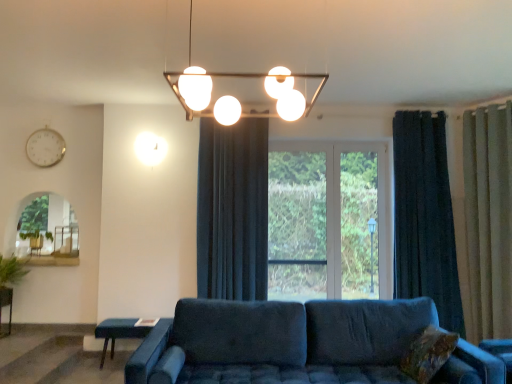
Question: Is velvet blue couch at center positioned far away from metallic pendant light at upper center?

Choices:
 (A) no
 (B) yes

Answer: (B)

Question: Is velvet blue couch at center shorter than metallic pendant light at upper center?

Choices:
 (A) yes
 (B) no

Answer: (B)

Question: Are velvet blue couch at center and metallic pendant light at upper center making contact?

Choices:
 (A) no
 (B) yes

Answer: (A)

Question: Is velvet blue couch at center surrounding metallic pendant light at upper center?

Choices:
 (A) no
 (B) yes

Answer: (A)

Question: Is velvet blue couch at center to the left of metallic pendant light at upper center from the viewer's perspective?

Choices:
 (A) yes
 (B) no

Answer: (B)

Question: Does velvet blue couch at center have a greater width compared to metallic pendant light at upper center?

Choices:
 (A) yes
 (B) no

Answer: (A)

Question: Does velvet blue couch at center lie behind green leafy plant at left?

Choices:
 (A) no
 (B) yes

Answer: (A)

Question: From the image's perspective, would you say velvet blue couch at center is shown under green leafy plant at left?

Choices:
 (A) no
 (B) yes

Answer: (B)

Question: From a real-world perspective, is velvet blue couch at center physically below green leafy plant at left?

Choices:
 (A) no
 (B) yes

Answer: (B)

Question: Is velvet blue couch at center taller than green leafy plant at left?

Choices:
 (A) no
 (B) yes

Answer: (B)

Question: Is velvet blue couch at center bigger than green leafy plant at left?

Choices:
 (A) yes
 (B) no

Answer: (A)

Question: Is velvet blue couch at center not inside green leafy plant at left?

Choices:
 (A) yes
 (B) no

Answer: (A)

Question: Is dark blue velvet curtain at center, the first curtain in the left-to-right sequence, shorter than white metallic clock at upper left?

Choices:
 (A) yes
 (B) no

Answer: (B)